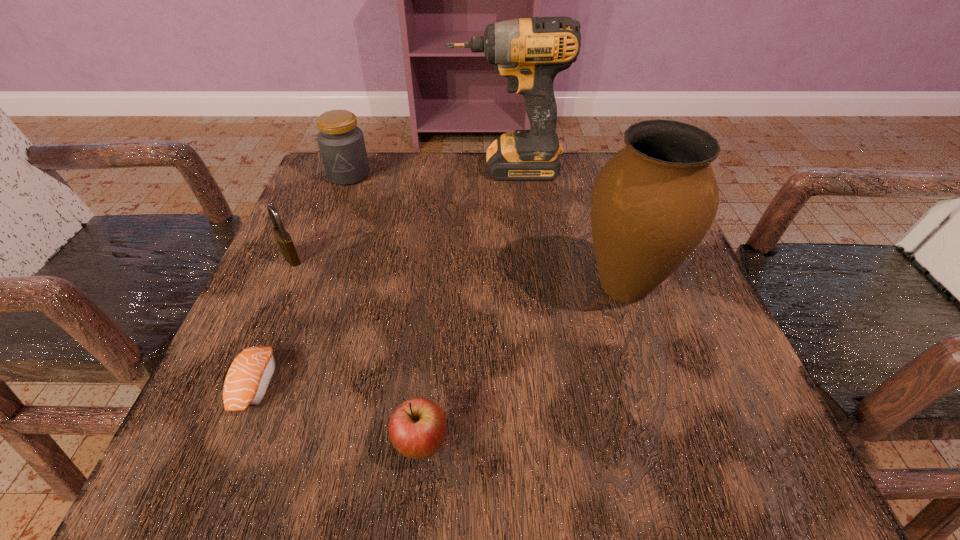
The image size is (960, 540). I want to click on jar at the left edge, so click(341, 143).

Locate an element on the screen. The image size is (960, 540). padlock that is at the left edge is located at coordinates (284, 240).

This screenshot has height=540, width=960. I want to click on sushi located at the left edge, so click(x=248, y=378).

Locate an element on the screen. The width and height of the screenshot is (960, 540). object that is at the right edge is located at coordinates [x=653, y=202].

This screenshot has height=540, width=960. Identify the location of object that is at the far left corner. (341, 143).

At what (x,y) coordinates should I click in order to perform the action: click on object that is at the near left corner. Please return your answer as a coordinate pair (x, y). The image size is (960, 540). Looking at the image, I should click on (248, 378).

Find the location of a particular element. The image size is (960, 540). vacant space at the far edge is located at coordinates (434, 157).

Where is `free space at the near edge of the desktop`? The width and height of the screenshot is (960, 540). free space at the near edge of the desktop is located at coordinates (645, 448).

Locate an element on the screen. The image size is (960, 540). free region at the left edge of the desktop is located at coordinates (313, 295).

Where is `vacant space at the near right corner of the desktop`? vacant space at the near right corner of the desktop is located at coordinates (791, 469).